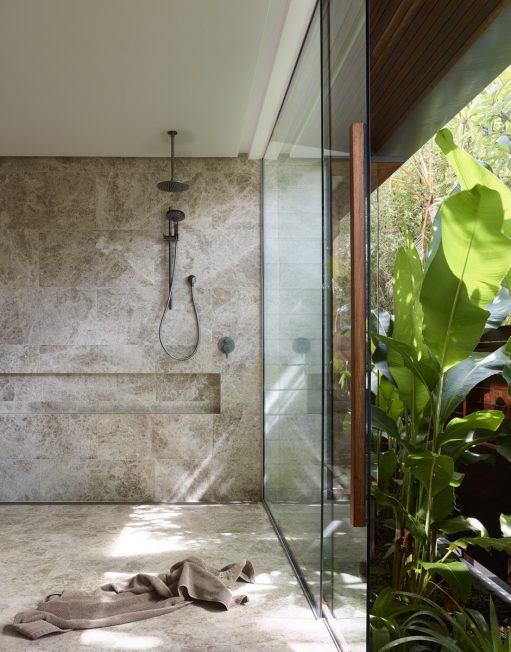
Identify the location of glass. (284, 385), (336, 589).